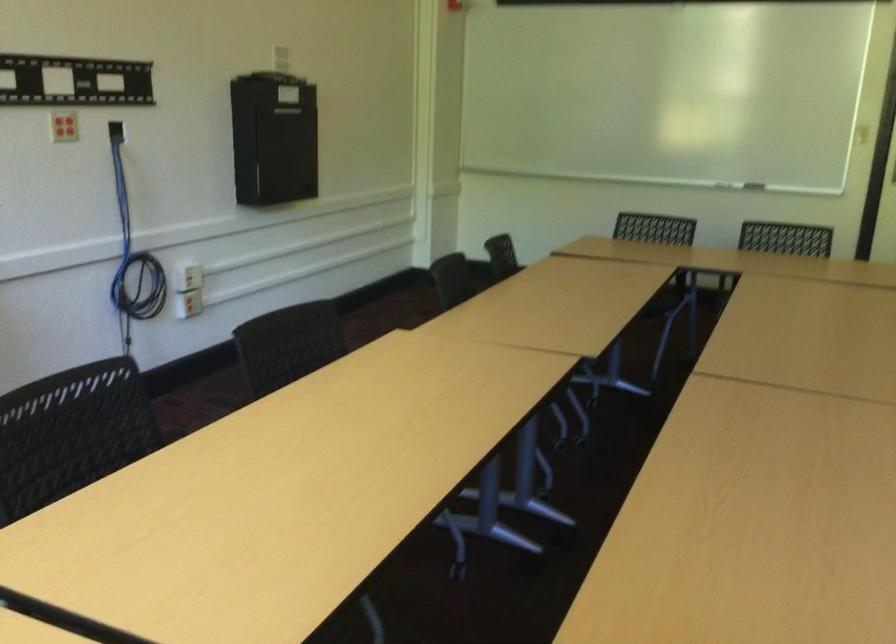
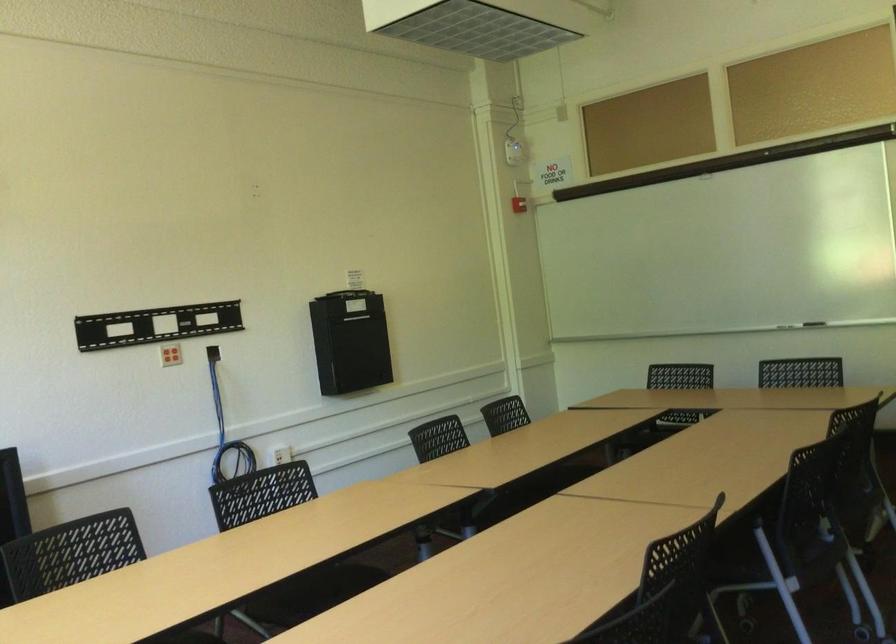
The point at (x=763, y=178) is marked in the first image. Where is the corresponding point in the second image?

(814, 323)